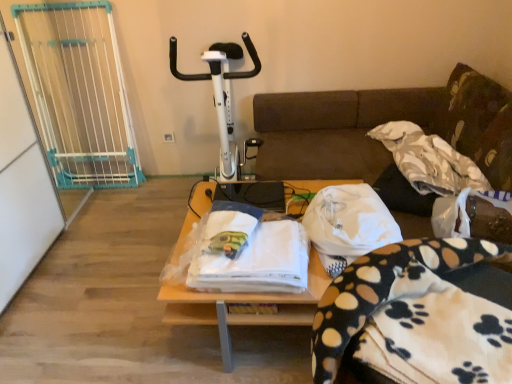
Question: From the image's perspective, is fluffy green pillow at upper right positioned above or below white fabric at center?

Choices:
 (A) above
 (B) below

Answer: (A)

Question: Is fluffy green pillow at upper right taller or shorter than white fabric at center?

Choices:
 (A) tall
 (B) short

Answer: (A)

Question: Considering the real-world distances, which object is farthest from the white fleece blanket with paw prints at lower right, positioned as the second blanket in right-to-left order?

Choices:
 (A) white fabric at center
 (B) white plastic exercise bike at center
 (C) fluffy green pillow at upper right
 (D) white fleece blanket at center, which ranks as the second blanket in front-to-back order
 (E) white textured blanket at upper right, the 1th blanket in the right-to-left sequence

Answer: (B)

Question: Estimate the real-world distances between objects in this image. Which object is closer to the white fleece blanket with paw prints at lower right, acting as the 1th blanket starting from the front?

Choices:
 (A) fluffy green pillow at upper right
 (B) white fabric at center
 (C) white plastic exercise bike at center
 (D) white textured blanket at upper right, which appears as the 1th blanket when viewed from the back
 (E) white fleece blanket at center, acting as the 2th blanket starting from the back

Answer: (E)